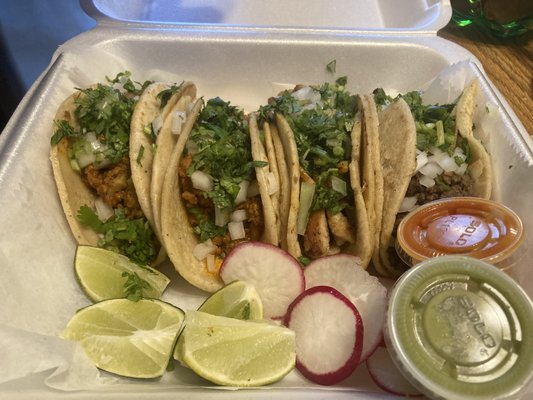
This screenshot has height=400, width=533. In order to click on wood surface in this screenshot , I will do `click(511, 79)`.